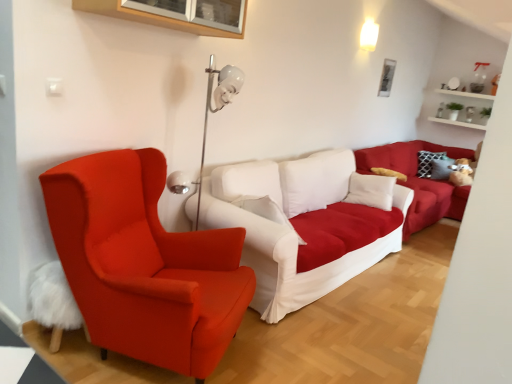
Question: Is metallic silver picture frame at upper center to the left of white fabric couch at center, which ranks as the first studio couch in front-to-back order, from the viewer's perspective?

Choices:
 (A) no
 (B) yes

Answer: (A)

Question: Can you confirm if metallic silver picture frame at upper center is shorter than white fabric couch at center, the 2th studio couch viewed from the back?

Choices:
 (A) no
 (B) yes

Answer: (B)

Question: Considering the relative sizes of metallic silver picture frame at upper center and white fabric couch at center, which ranks as the first studio couch in front-to-back order, in the image provided, is metallic silver picture frame at upper center bigger than white fabric couch at center, which ranks as the first studio couch in front-to-back order,?

Choices:
 (A) no
 (B) yes

Answer: (A)

Question: Is metallic silver picture frame at upper center positioned with its back to white fabric couch at center, the 2th studio couch viewed from the back?

Choices:
 (A) yes
 (B) no

Answer: (B)

Question: Is metallic silver picture frame at upper center with white fabric couch at center, the 2th studio couch viewed from the back?

Choices:
 (A) yes
 (B) no

Answer: (B)

Question: Is metallic silver picture frame at upper center not close to white fabric couch at center, the 2th studio couch viewed from the back?

Choices:
 (A) yes
 (B) no

Answer: (A)

Question: Would you consider white wooden shelf at upper right to be distant from white fabric couch at center, the 2th studio couch viewed from the back?

Choices:
 (A) yes
 (B) no

Answer: (A)

Question: From a real-world perspective, is white wooden shelf at upper right on white fabric couch at center, the 2th studio couch viewed from the back?

Choices:
 (A) yes
 (B) no

Answer: (A)

Question: Is white wooden shelf at upper right to the right of white fabric couch at center, the 2th studio couch viewed from the back, from the viewer's perspective?

Choices:
 (A) yes
 (B) no

Answer: (A)

Question: From the image's perspective, would you say white wooden shelf at upper right is shown under white fabric couch at center, the 2th studio couch viewed from the back?

Choices:
 (A) yes
 (B) no

Answer: (B)

Question: Considering the relative sizes of white wooden shelf at upper right and white fabric couch at center, which ranks as the first studio couch in front-to-back order, in the image provided, is white wooden shelf at upper right taller than white fabric couch at center, which ranks as the first studio couch in front-to-back order,?

Choices:
 (A) no
 (B) yes

Answer: (A)

Question: Is white wooden shelf at upper right smaller than white fabric couch at center, which ranks as the first studio couch in front-to-back order?

Choices:
 (A) yes
 (B) no

Answer: (A)

Question: Can you confirm if white fabric couch at center, the 1th studio couch from the back, is positioned to the right of white wooden shelf at upper right?

Choices:
 (A) no
 (B) yes

Answer: (A)